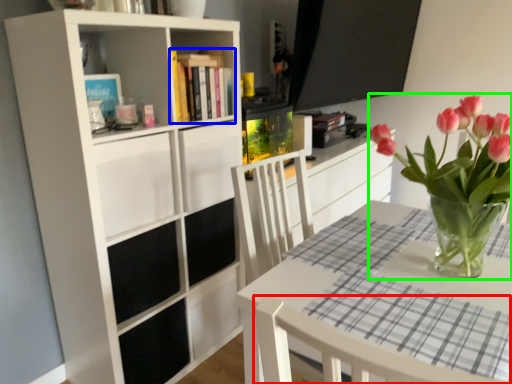
Question: Which object is the farthest from chair (highlighted by a red box)? Choose among these: book (highlighted by a blue box) or houseplant (highlighted by a green box).

Choices:
 (A) book
 (B) houseplant

Answer: (A)